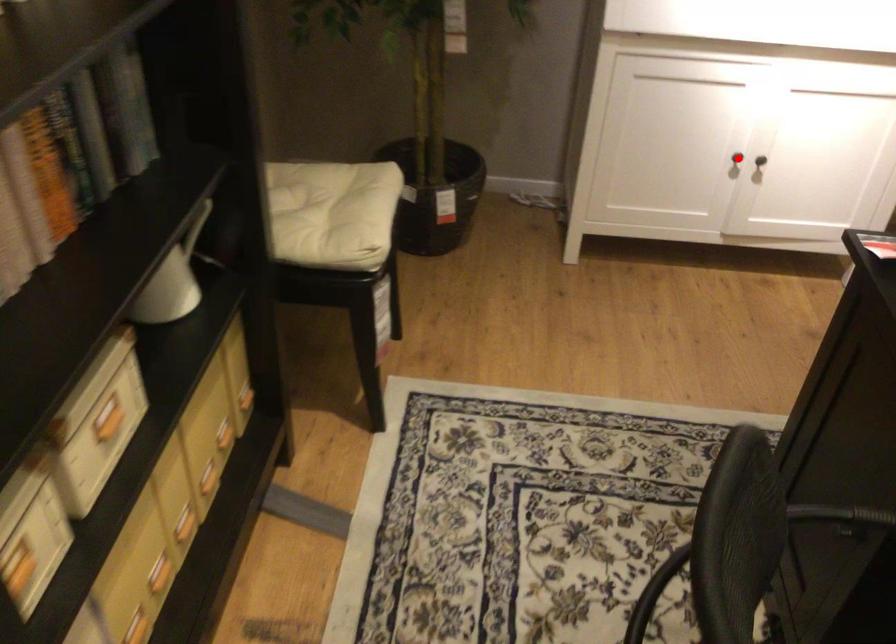
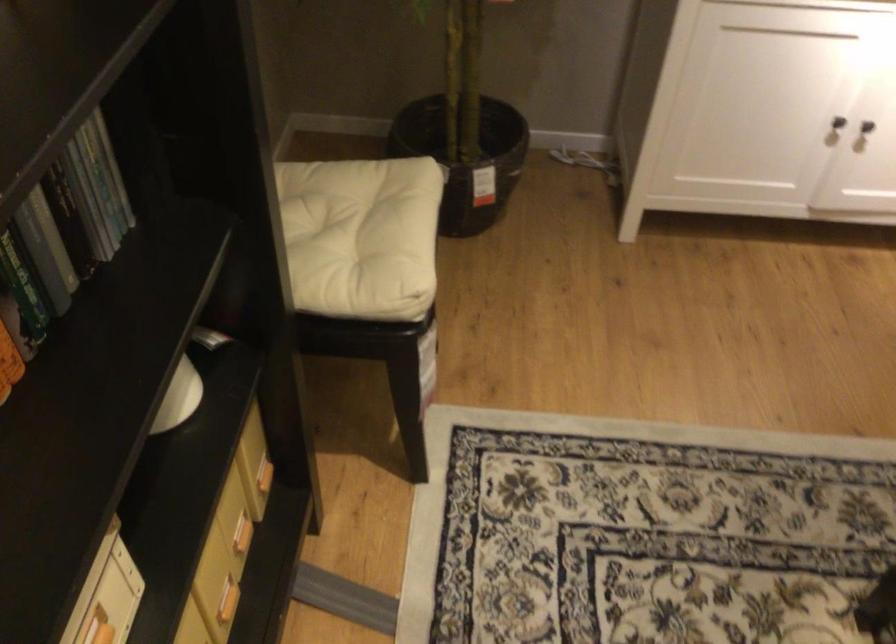
Question: I am providing you with two images of the same scene from different viewpoints. Given a red point in image1, look at the same physical point in image2. Is it:

Choices:
 (A) Closer to the viewpoint
 (B) Farther from the viewpoint

Answer: (A)